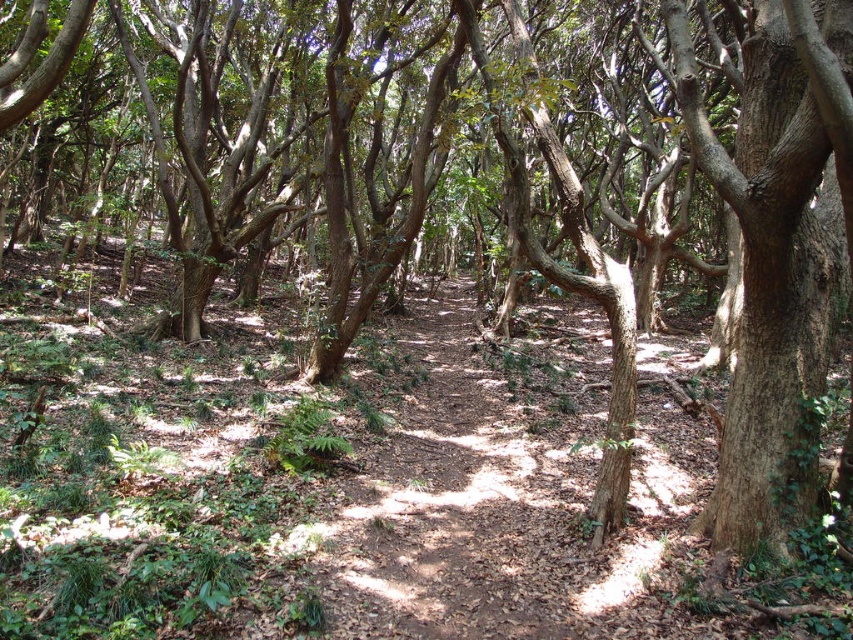
Question: Is brown dirt trail at center behind brown rough bark tree at right?

Choices:
 (A) yes
 (B) no

Answer: (A)

Question: Which point is farther to the camera?

Choices:
 (A) brown dirt trail at center
 (B) brown rough bark tree at right

Answer: (A)

Question: In this image, where is brown dirt trail at center located relative to brown rough bark tree at right?

Choices:
 (A) right
 (B) left

Answer: (B)

Question: Which point is closer to the camera?

Choices:
 (A) (721, 502)
 (B) (680, 516)

Answer: (A)

Question: Does brown dirt trail at center appear on the left side of brown rough bark tree at right?

Choices:
 (A) yes
 (B) no

Answer: (A)